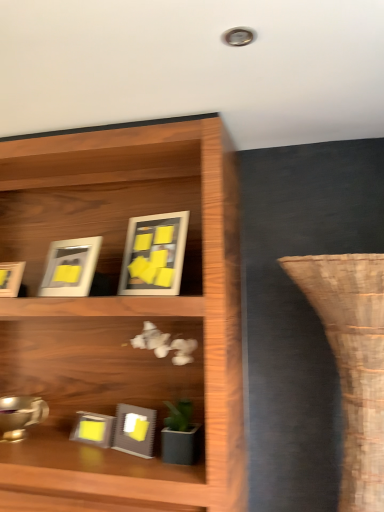
Describe the element at coordinates (154, 254) in the screenshot. I see `matte glass picture frame at center, the 5th picture frame in the bottom-to-top sequence` at that location.

In order to face matte white picture frame at left, which is counted as the 3th picture frame, starting from the top, should I rotate leftwards or rightwards?

Rotate your view left by about 24.340°.

What do you see at coordinates (70, 267) in the screenshot?
I see `matte white picture frame at upper left, positioned as the 4th picture frame in bottom-to-top order` at bounding box center [70, 267].

This screenshot has height=512, width=384. What do you see at coordinates (353, 361) in the screenshot? I see `brown woven vase at right` at bounding box center [353, 361].

Locate an element on the screen. matte glass picture frame at center, which is the first picture frame in top-to-bottom order is located at coordinates (154, 254).

There is a matte white picture frame at left, which ranks as the third picture frame in bottom-to-top order. Where is `the 2nd picture frame below it (from a real-world perspective)`? the 2nd picture frame below it (from a real-world perspective) is located at coordinates (93, 429).

How many degrees apart are the facing directions of matte gray picture frame at lower left, which is the first picture frame from bottom to top, and matte white picture frame at left, which ranks as the third picture frame in bottom-to-top order?

The facing directions of matte gray picture frame at lower left, which is the first picture frame from bottom to top, and matte white picture frame at left, which ranks as the third picture frame in bottom-to-top order, are 9.69 degrees apart.

Is matte gray picture frame at lower left, which is the 5th picture frame from top to bottom, far away from matte white picture frame at left, which ranks as the third picture frame in bottom-to-top order?

matte gray picture frame at lower left, which is the 5th picture frame from top to bottom, is actually quite close to matte white picture frame at left, which ranks as the third picture frame in bottom-to-top order.

Can you confirm if matte gray picture frame at lower left, which is the first picture frame from bottom to top, is smaller than matte white picture frame at left, which ranks as the third picture frame in bottom-to-top order?

No, matte gray picture frame at lower left, which is the first picture frame from bottom to top, is not smaller than matte white picture frame at left, which ranks as the third picture frame in bottom-to-top order.

In the scene shown: How many degrees apart are the facing directions of matte white picture frame at left, which is counted as the 3th picture frame, starting from the top, and matte glass picture frame at center, which is the first picture frame in top-to-bottom order?

4.65 degrees separate the facing orientations of matte white picture frame at left, which is counted as the 3th picture frame, starting from the top, and matte glass picture frame at center, which is the first picture frame in top-to-bottom order.

Would you say matte white picture frame at left, which ranks as the third picture frame in bottom-to-top order, is to the left or to the right of matte glass picture frame at center, the 5th picture frame in the bottom-to-top sequence, in the picture?

In the image, matte white picture frame at left, which ranks as the third picture frame in bottom-to-top order, appears on the left side of matte glass picture frame at center, the 5th picture frame in the bottom-to-top sequence.

In the scene shown: From the image's perspective, between matte white picture frame at left, which is counted as the 3th picture frame, starting from the top, and matte glass picture frame at center, the 5th picture frame in the bottom-to-top sequence, who is located below?

matte white picture frame at left, which is counted as the 3th picture frame, starting from the top, appears lower in the image.

Who is taller, matte white picture frame at left, which is counted as the 3th picture frame, starting from the top, or matte glass picture frame at center, the 5th picture frame in the bottom-to-top sequence?

matte glass picture frame at center, the 5th picture frame in the bottom-to-top sequence.

Is brown woven vase at right aimed at matte gray picture frame at lower left, which is the 5th picture frame from top to bottom?

No, brown woven vase at right is not facing towards matte gray picture frame at lower left, which is the 5th picture frame from top to bottom.

Considering the relative positions of brown woven vase at right and matte gray picture frame at lower left, which is the 5th picture frame from top to bottom, in the image provided, is brown woven vase at right behind matte gray picture frame at lower left, which is the 5th picture frame from top to bottom,?

No, it is not.

Considering the points (340, 324) and (88, 437), which point is behind, point (340, 324) or point (88, 437)?

The point (88, 437) is farther from the camera.

Can you confirm if brown woven vase at right is positioned to the left of matte gray picture frame at lower left, which is the 5th picture frame from top to bottom?

No, brown woven vase at right is not to the left of matte gray picture frame at lower left, which is the 5th picture frame from top to bottom.

Is point (112, 438) closer or farther from the camera than point (145, 240)?

Point (112, 438).

In the image, is matte gray picture frame at lower left, which is the 5th picture frame from top to bottom, positioned in front of or behind matte glass picture frame at center, which is the first picture frame in top-to-bottom order?

matte gray picture frame at lower left, which is the 5th picture frame from top to bottom, is positioned farther from the viewer than matte glass picture frame at center, which is the first picture frame in top-to-bottom order.

Choose the correct answer: Is matte gray picture frame at lower left, which is the first picture frame from bottom to top, inside matte glass picture frame at center, the 5th picture frame in the bottom-to-top sequence, or outside it?

matte gray picture frame at lower left, which is the first picture frame from bottom to top, is spatially situated outside matte glass picture frame at center, the 5th picture frame in the bottom-to-top sequence.

Which of these two, matte gray picture frame at lower left, which is the 5th picture frame from top to bottom, or matte glass picture frame at center, which is the first picture frame in top-to-bottom order, is wider?

Result: matte gray picture frame at lower left, which is the 5th picture frame from top to bottom, is wider.

From the image's perspective, would you say matte white picture frame at upper left, positioned as the 4th picture frame in bottom-to-top order, is shown under matte gray picture frame at center, arranged as the second picture frame when ordered from the bottom?

No, from the image's perspective, matte white picture frame at upper left, positioned as the 4th picture frame in bottom-to-top order, is not beneath matte gray picture frame at center, arranged as the second picture frame when ordered from the bottom.

Could you measure the distance between matte white picture frame at upper left, positioned as the 4th picture frame in bottom-to-top order, and matte gray picture frame at center, which appears as the 4th picture frame when viewed from the top?

The distance of matte white picture frame at upper left, positioned as the 4th picture frame in bottom-to-top order, from matte gray picture frame at center, which appears as the 4th picture frame when viewed from the top, is 66.69 centimeters.

Are matte white picture frame at upper left, which ranks as the second picture frame in top-to-bottom order, and matte gray picture frame at center, arranged as the second picture frame when ordered from the bottom, located far from each other?

No, matte white picture frame at upper left, which ranks as the second picture frame in top-to-bottom order, is not far away from matte gray picture frame at center, arranged as the second picture frame when ordered from the bottom.

From a real-world perspective, which is physically below, matte white picture frame at upper left, positioned as the 4th picture frame in bottom-to-top order, or matte gray picture frame at center, which appears as the 4th picture frame when viewed from the top?

matte gray picture frame at center, which appears as the 4th picture frame when viewed from the top, from a real-world perspective.

Between matte gray picture frame at lower left, which is the 5th picture frame from top to bottom, and brown woven vase at right, which one has less height?

Standing shorter between the two is matte gray picture frame at lower left, which is the 5th picture frame from top to bottom.

From a real-world perspective, who is located lower, matte gray picture frame at lower left, which is the 5th picture frame from top to bottom, or brown woven vase at right?

matte gray picture frame at lower left, which is the 5th picture frame from top to bottom, is physically lower.

Based on the photo, is the depth of matte gray picture frame at lower left, which is the first picture frame from bottom to top, less than that of brown woven vase at right?

No, it is behind brown woven vase at right.

Is point (90, 441) farther from camera compared to point (60, 291)?

Yes, point (90, 441) is farther from viewer.

Considering the relative positions of matte gray picture frame at lower left, which is the first picture frame from bottom to top, and matte white picture frame at upper left, positioned as the 4th picture frame in bottom-to-top order, in the image provided, is matte gray picture frame at lower left, which is the first picture frame from bottom to top, to the right of matte white picture frame at upper left, positioned as the 4th picture frame in bottom-to-top order, from the viewer's perspective?

Correct, you'll find matte gray picture frame at lower left, which is the first picture frame from bottom to top, to the right of matte white picture frame at upper left, positioned as the 4th picture frame in bottom-to-top order.

Considering the sizes of objects matte gray picture frame at lower left, which is the first picture frame from bottom to top, and matte white picture frame at upper left, which ranks as the second picture frame in top-to-bottom order, in the image provided, who is smaller, matte gray picture frame at lower left, which is the first picture frame from bottom to top, or matte white picture frame at upper left, which ranks as the second picture frame in top-to-bottom order,?

matte gray picture frame at lower left, which is the first picture frame from bottom to top, is smaller.

Is matte gray picture frame at lower left, which is the 5th picture frame from top to bottom, outside of matte white picture frame at upper left, which ranks as the second picture frame in top-to-bottom order?

Indeed, matte gray picture frame at lower left, which is the 5th picture frame from top to bottom, is completely outside matte white picture frame at upper left, which ranks as the second picture frame in top-to-bottom order.

At what (x,y) coordinates should I click in order to perform the action: click on the 2nd picture frame above the matte gray picture frame at lower left, which is the 5th picture frame from top to bottom (from a real-world perspective). Please return your answer as a coordinate pair (x, y). The image size is (384, 512). Looking at the image, I should click on (11, 278).

Locate an element on the screen. The image size is (384, 512). picture frame that is the 4th object located in front of the matte white picture frame at left, which is counted as the 3th picture frame, starting from the top is located at coordinates (154, 254).

In the scene shown: Looking at the image, which one is located closer to matte white picture frame at left, which ranks as the third picture frame in bottom-to-top order, brown woven vase at right or matte gray picture frame at lower left, which is the first picture frame from bottom to top?

matte gray picture frame at lower left, which is the first picture frame from bottom to top, is positioned closer to the anchor matte white picture frame at left, which ranks as the third picture frame in bottom-to-top order.

Considering their positions, is matte glass picture frame at center, which is the first picture frame in top-to-bottom order, positioned closer to matte gray picture frame at center, which appears as the 4th picture frame when viewed from the top, than matte white picture frame at left, which is counted as the 3th picture frame, starting from the top?

Among the two, matte glass picture frame at center, which is the first picture frame in top-to-bottom order, is located nearer to matte gray picture frame at center, which appears as the 4th picture frame when viewed from the top.

Looking at the image, which one is located further to matte glass picture frame at center, which is the first picture frame in top-to-bottom order, matte white picture frame at left, which ranks as the third picture frame in bottom-to-top order, or matte gray picture frame at center, which appears as the 4th picture frame when viewed from the top?

matte gray picture frame at center, which appears as the 4th picture frame when viewed from the top, lies further to matte glass picture frame at center, which is the first picture frame in top-to-bottom order, than the other object.

Based on their spatial positions, is matte gray picture frame at center, arranged as the second picture frame when ordered from the bottom, or matte gray picture frame at lower left, which is the first picture frame from bottom to top, further from matte glass picture frame at center, which is the first picture frame in top-to-bottom order?

The object further to matte glass picture frame at center, which is the first picture frame in top-to-bottom order, is matte gray picture frame at lower left, which is the first picture frame from bottom to top.

Which object lies nearer to the anchor point brown woven vase at right, matte gray picture frame at lower left, which is the first picture frame from bottom to top, or matte glass picture frame at center, which is the first picture frame in top-to-bottom order?

Among the two, matte glass picture frame at center, which is the first picture frame in top-to-bottom order, is located nearer to brown woven vase at right.

Based on their spatial positions, is matte glass picture frame at center, which is the first picture frame in top-to-bottom order, or matte gray picture frame at center, arranged as the second picture frame when ordered from the bottom, further from matte white picture frame at upper left, positioned as the 4th picture frame in bottom-to-top order?

matte gray picture frame at center, arranged as the second picture frame when ordered from the bottom, is further to matte white picture frame at upper left, positioned as the 4th picture frame in bottom-to-top order.

Which object lies nearer to the anchor point matte gray picture frame at lower left, which is the first picture frame from bottom to top, matte gray picture frame at center, which appears as the 4th picture frame when viewed from the top, or matte glass picture frame at center, the 5th picture frame in the bottom-to-top sequence?

matte gray picture frame at center, which appears as the 4th picture frame when viewed from the top, is positioned closer to the anchor matte gray picture frame at lower left, which is the first picture frame from bottom to top.

Considering their positions, is matte gray picture frame at center, which appears as the 4th picture frame when viewed from the top, positioned closer to matte white picture frame at upper left, which ranks as the second picture frame in top-to-bottom order, than matte gray picture frame at lower left, which is the 5th picture frame from top to bottom?

matte gray picture frame at center, which appears as the 4th picture frame when viewed from the top, is closer to matte white picture frame at upper left, which ranks as the second picture frame in top-to-bottom order.

At what (x,y) coordinates should I click in order to perform the action: click on picture frame that lies between matte white picture frame at upper left, positioned as the 4th picture frame in bottom-to-top order, and matte gray picture frame at center, arranged as the second picture frame when ordered from the bottom, from top to bottom. Please return your answer as a coordinate pair (x, y). Image resolution: width=384 pixels, height=512 pixels. Looking at the image, I should click on (11, 278).

I want to click on picture frame between matte white picture frame at left, which is counted as the 3th picture frame, starting from the top, and matte gray picture frame at lower left, which is the first picture frame from bottom to top, in the vertical direction, so click(x=135, y=430).

Where is `picture frame situated between matte gray picture frame at center, arranged as the second picture frame when ordered from the bottom, and brown woven vase at right from left to right`? Image resolution: width=384 pixels, height=512 pixels. picture frame situated between matte gray picture frame at center, arranged as the second picture frame when ordered from the bottom, and brown woven vase at right from left to right is located at coordinates (154, 254).